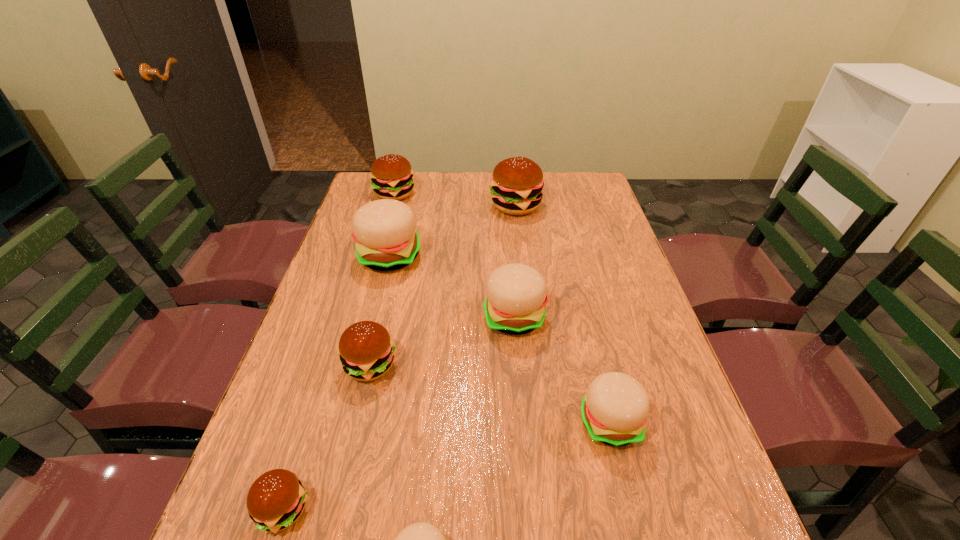
Identify the location of the smallest brown hamburger. Image resolution: width=960 pixels, height=540 pixels. (276, 499).

Identify the location of blank space located 0.340m on the front of the rightmost brown hamburger. click(x=525, y=288).

Identify the location of vacant position located on the back of the biggest beige hamburger. The image size is (960, 540). (401, 208).

At what (x,y) coordinates should I click in order to perform the action: click on free location located on the front of the third smallest brown hamburger. Please return your answer as a coordinate pair (x, y). The height and width of the screenshot is (540, 960). Looking at the image, I should click on (376, 258).

Locate an element on the screen. Image resolution: width=960 pixels, height=540 pixels. vacant space located on the front of the fifth nearest hamburger is located at coordinates (527, 475).

Identify the location of vacant point located 0.070m on the left of the third biggest brown hamburger. This screenshot has width=960, height=540. (313, 366).

Where is `free space located 0.290m on the left of the third farthest beige hamburger`? free space located 0.290m on the left of the third farthest beige hamburger is located at coordinates click(x=443, y=422).

Image resolution: width=960 pixels, height=540 pixels. Find the location of `vacant space located 0.120m on the right of the nearest brown hamburger`. vacant space located 0.120m on the right of the nearest brown hamburger is located at coordinates (376, 509).

Find the location of a particular element. object at the right edge is located at coordinates (614, 411).

I want to click on object located in the far left corner section of the desktop, so click(x=391, y=175).